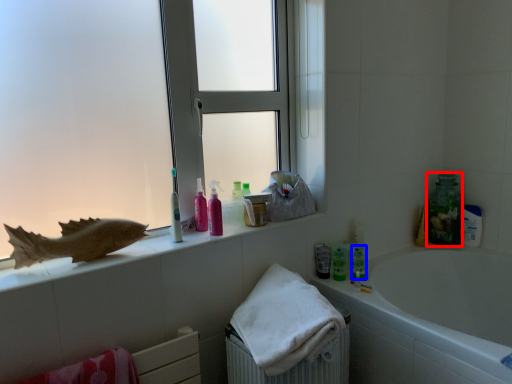
Question: Which point is further to the camera, cleaning product (highlighted by a red box) or toiletry (highlighted by a blue box)?

Choices:
 (A) cleaning product
 (B) toiletry

Answer: (A)